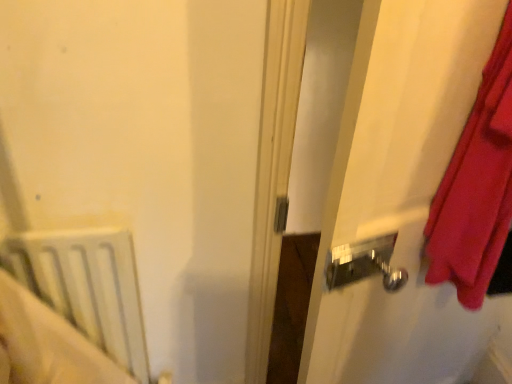
Question: In the image, is white glossy door handle at right on the left side or the right side of white matte radiator at lower left?

Choices:
 (A) left
 (B) right

Answer: (B)

Question: Do you think white glossy door handle at right is within white matte radiator at lower left, or outside of it?

Choices:
 (A) outside
 (B) inside

Answer: (A)

Question: Looking at the image, does white glossy door handle at right seem bigger or smaller compared to white matte radiator at lower left?

Choices:
 (A) small
 (B) big

Answer: (B)

Question: Is white matte radiator at lower left to the left or to the right of white glossy door handle at right in the image?

Choices:
 (A) right
 (B) left

Answer: (B)

Question: Is white matte radiator at lower left inside or outside of white glossy door handle at right?

Choices:
 (A) outside
 (B) inside

Answer: (A)

Question: Is point (91, 246) positioned closer to the camera than point (309, 382)?

Choices:
 (A) farther
 (B) closer

Answer: (B)

Question: From a real-world perspective, is white matte radiator at lower left above or below white glossy door handle at right?

Choices:
 (A) below
 (B) above

Answer: (A)